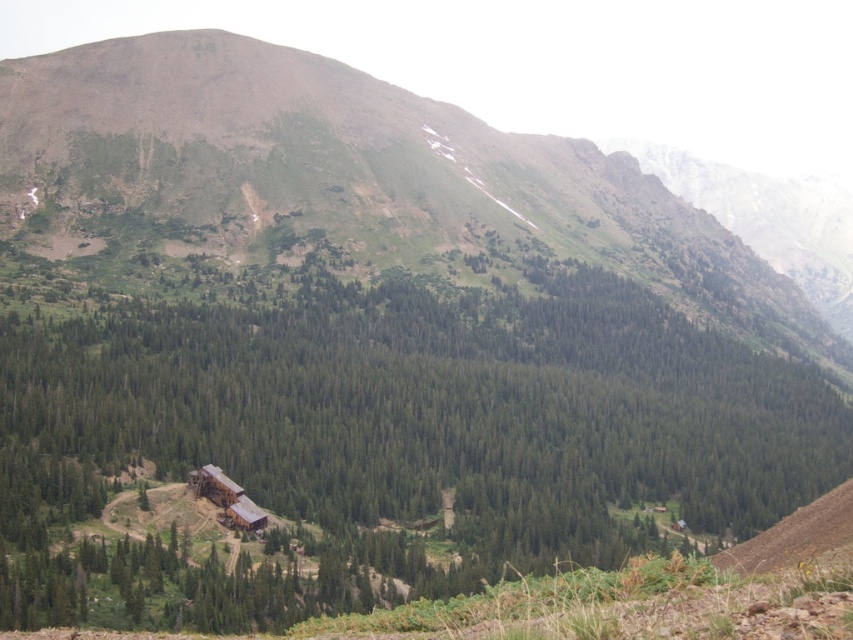
Can you confirm if green wood cabin at center is wider than green grassy mountain at upper center?

No.

Is point (486, 330) positioned behind point (61, 179)?

No, it is in front of (61, 179).

Where is `green wood cabin at center`? Image resolution: width=853 pixels, height=640 pixels. green wood cabin at center is located at coordinates (390, 440).